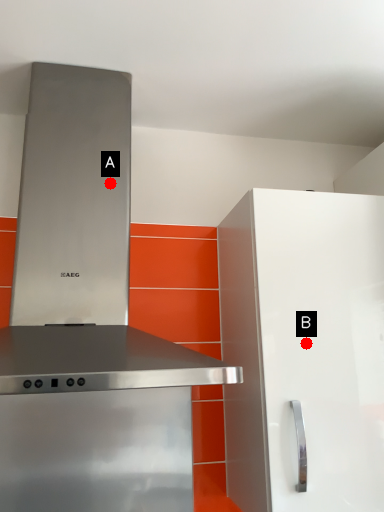
Question: Two points are circled on the image, labeled by A and B beside each circle. Which point is closer to the camera?

Choices:
 (A) A is closer
 (B) B is closer

Answer: (B)